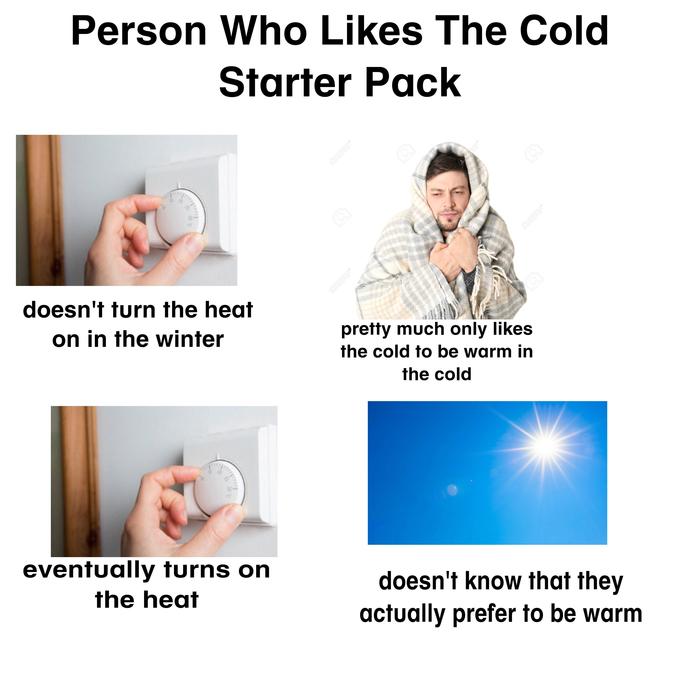
Locate an element on the screen. The width and height of the screenshot is (680, 680). knob is located at coordinates (187, 216).